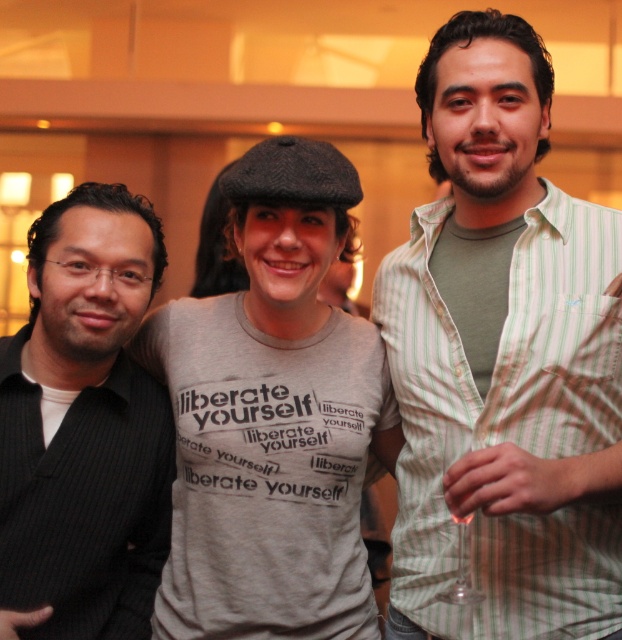
Question: Can you confirm if gray cotton t-shirt at center is thinner than black pinstripe suit at left?

Choices:
 (A) no
 (B) yes

Answer: (A)

Question: Does gray cotton t-shirt at center have a lesser width compared to black pinstripe suit at left?

Choices:
 (A) no
 (B) yes

Answer: (A)

Question: Which object is positioned farthest from the gray cotton t-shirt at center?

Choices:
 (A) black pinstripe suit at left
 (B) green striped shirt at center

Answer: (B)

Question: Which object is positioned farthest from the gray cotton t-shirt at center?

Choices:
 (A) black pinstripe suit at left
 (B) green striped shirt at center

Answer: (B)

Question: Which of these objects is positioned farthest from the green striped shirt at center?

Choices:
 (A) black pinstripe suit at left
 (B) gray cotton t-shirt at center

Answer: (A)

Question: Is the position of green striped shirt at center less distant than that of black pinstripe suit at left?

Choices:
 (A) no
 (B) yes

Answer: (B)